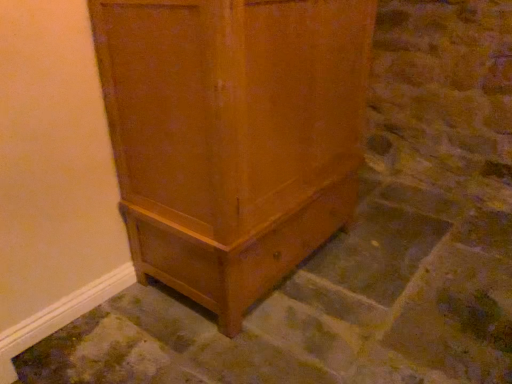
Describe the element at coordinates (233, 136) in the screenshot. I see `matte wood cabinet at center` at that location.

Where is `matte wood cabinet at center`? The image size is (512, 384). matte wood cabinet at center is located at coordinates (233, 136).

Where is `matte wood cabinet at center`? Image resolution: width=512 pixels, height=384 pixels. matte wood cabinet at center is located at coordinates (233, 136).